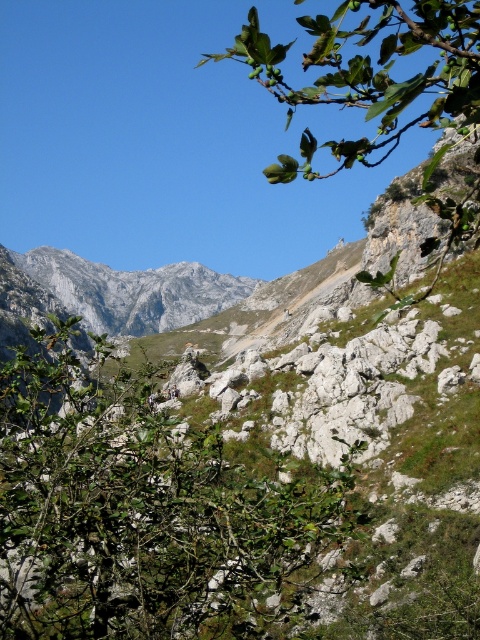
Does green leafy shrub at center lie in front of green leafy branch at upper right?

No, green leafy shrub at center is further to the viewer.

Does green leafy shrub at center have a lesser height compared to green leafy branch at upper right?

Yes.

Where is `green leafy shrub at center`? The width and height of the screenshot is (480, 640). green leafy shrub at center is located at coordinates (141, 509).